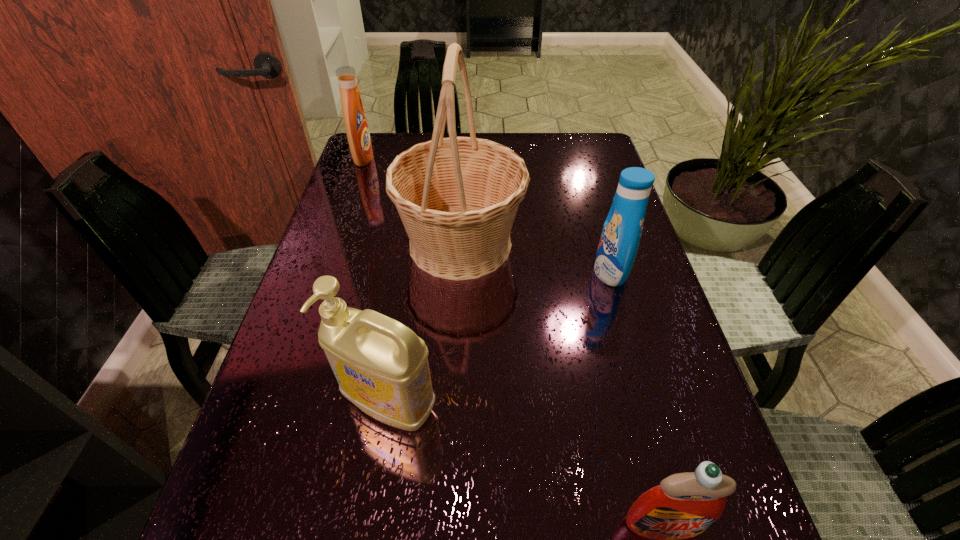
Locate which object is the second closest to the tallest object. Please provide its 2D coordinates. Your answer should be formatted as a tuple, i.e. [(x, y)], where the tuple contains the x and y coordinates of a point satisfying the conditions above.

[(381, 365)]

Locate an element on the screen. the second closest object relative to the leftmost object is located at coordinates (622, 230).

Select which detergent is the closest to the third nearest detergent. Please provide its 2D coordinates. Your answer should be formatted as a tuple, i.e. [(x, y)], where the tuple contains the x and y coordinates of a point satisfying the conditions above.

[(381, 365)]

Locate an element on the screen. This screenshot has height=540, width=960. detergent that is the second closest one to the leftmost object is located at coordinates (381, 365).

At what (x,y) coordinates should I click in order to perform the action: click on free spot that satisfies the following two spatial constraints: 1. on the front-facing side of the second nearest detergent; 2. on the right side of the leftmost object. Please return your answer as a coordinate pair (x, y). Looking at the image, I should click on (278, 404).

You are a GUI agent. You are given a task and a screenshot of the screen. Output one action in this format:
    pyautogui.click(x=<x>, y=<y>)
    Task: Click on the vacant point that satisfies the following two spatial constraints: 1. on the front-facing side of the third nearest detergent; 2. on the front side of the fourth farthest object
    
    Given the screenshot: What is the action you would take?
    pyautogui.click(x=649, y=404)

You are a GUI agent. You are given a task and a screenshot of the screen. Output one action in this format:
    pyautogui.click(x=<x>, y=<y>)
    Task: Click on the free location that satisfies the following two spatial constraints: 1. on the front-facing side of the leftmost detergent; 2. on the left side of the third detergent from right to left
    The height and width of the screenshot is (540, 960).
    Given the screenshot: What is the action you would take?
    pyautogui.click(x=278, y=404)

I want to click on free point that satisfies the following two spatial constraints: 1. on the back side of the basket; 2. on the front-facing side of the farthest detergent, so click(465, 158).

You are a GUI agent. You are given a task and a screenshot of the screen. Output one action in this format:
    pyautogui.click(x=<x>, y=<y>)
    Task: Click on the vacant space that satisfies the following two spatial constraints: 1. on the back side of the second nearest detergent; 2. on the left side of the basket
    This screenshot has height=540, width=960.
    Given the screenshot: What is the action you would take?
    pyautogui.click(x=415, y=244)

You are a GUI agent. You are given a task and a screenshot of the screen. Output one action in this format:
    pyautogui.click(x=<x>, y=<y>)
    Task: Click on the vacant area that satisfies the following two spatial constraints: 1. on the front-facing side of the third farthest detergent; 2. on the right side of the leftmost detergent
    This screenshot has height=540, width=960.
    Given the screenshot: What is the action you would take?
    (278, 404)